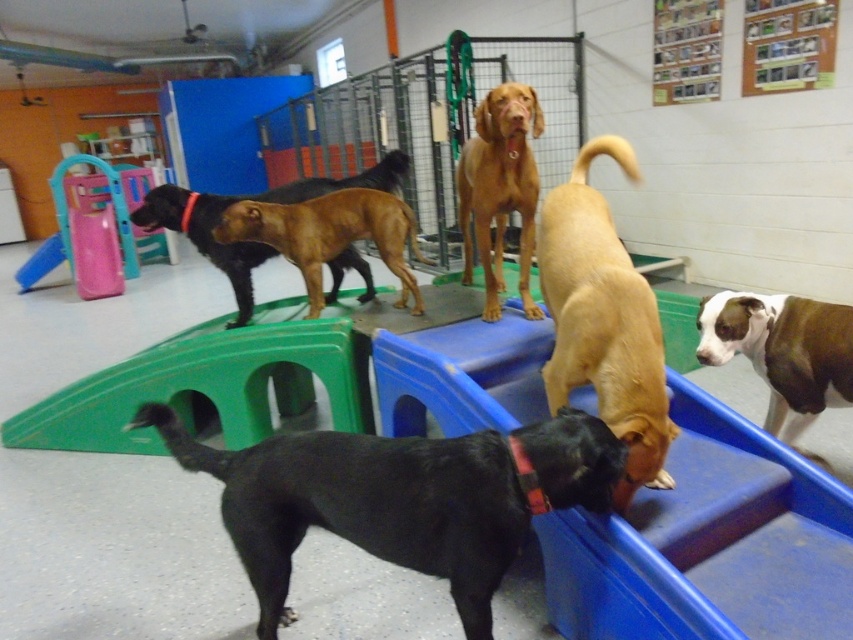
Question: Where is brown wire mesh cage at center located in relation to brown smooth dog at center in the image?

Choices:
 (A) left
 (B) right

Answer: (A)

Question: Does brown matte dog at center have a smaller size compared to brown smooth dog at center?

Choices:
 (A) no
 (B) yes

Answer: (A)

Question: Which of these objects is positioned farthest from the brown matte dog at center?

Choices:
 (A) brown wire mesh cage at center
 (B) brown/white fur at right
 (C) black smooth dog at lower left
 (D) light brown fur at center

Answer: (A)

Question: Does brown/white fur at right appear on the left side of brown matte dog at center?

Choices:
 (A) yes
 (B) no

Answer: (B)

Question: Based on their relative distances, which object is farther from the brown matte dog at center?

Choices:
 (A) brown wire mesh cage at center
 (B) black smooth dog at lower left
 (C) light brown fur at center
 (D) brown/white fur at right

Answer: (A)

Question: Among these objects, which one is farthest from the camera?

Choices:
 (A) brown matte dog at center
 (B) brown smooth dog at center
 (C) light brown fur at center
 (D) black smooth dog at lower left

Answer: (B)